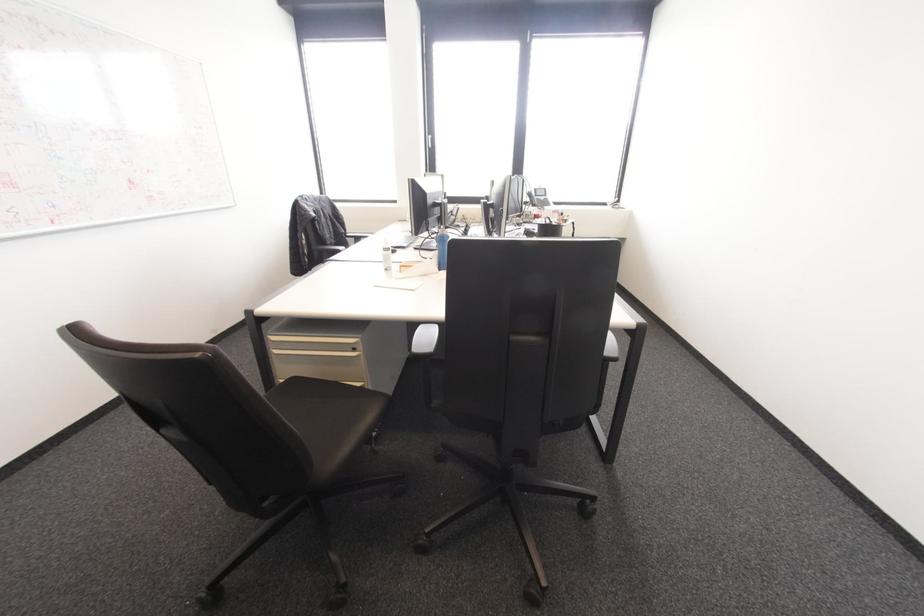
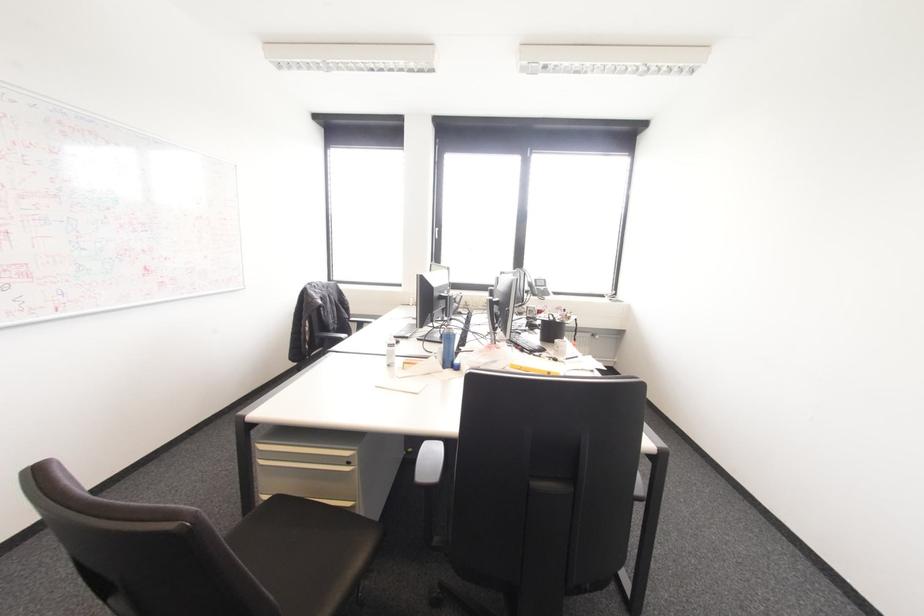
What movement of the cameraman would produce the second image?

The cameraman walked toward left, forward.